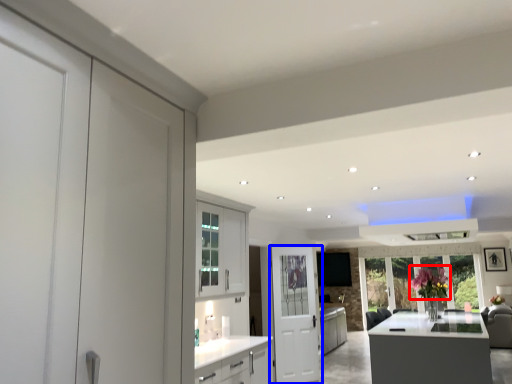
Question: Among these objects, which one is farthest to the camera, flower (highlighted by a red box) or door (highlighted by a blue box)?

Choices:
 (A) flower
 (B) door

Answer: (B)